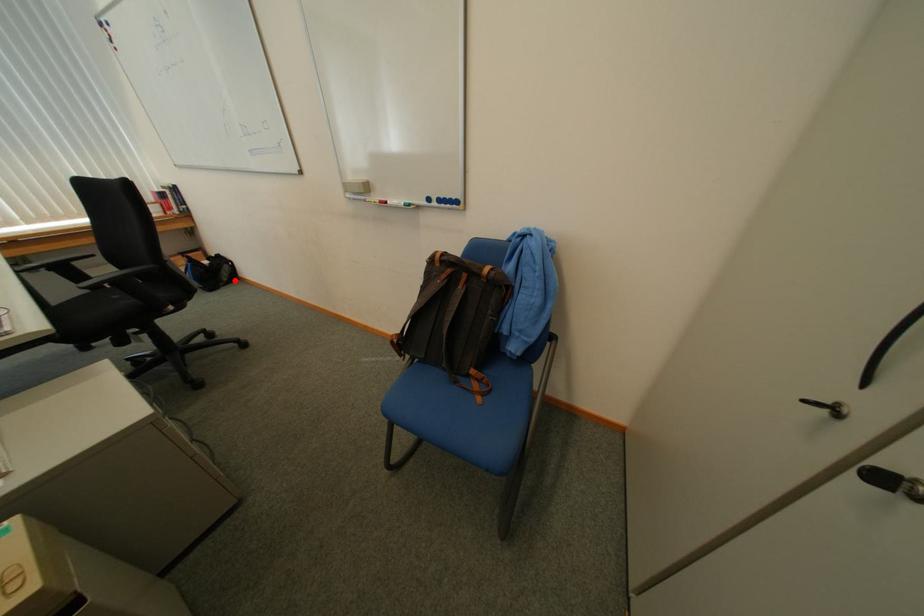
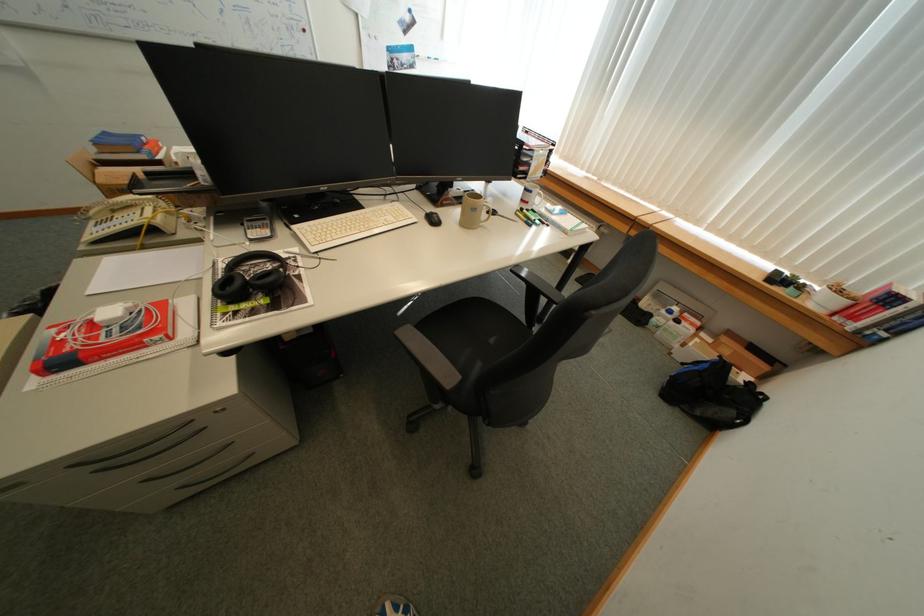
Question: I am providing you with two images of the same scene from different viewpoints. Image1 has a red point marked. In image2, the corresponding 3D location appears at what relative position? Reply with the corresponding letter.

Choices:
 (A) Closer
 (B) Farther

Answer: (A)